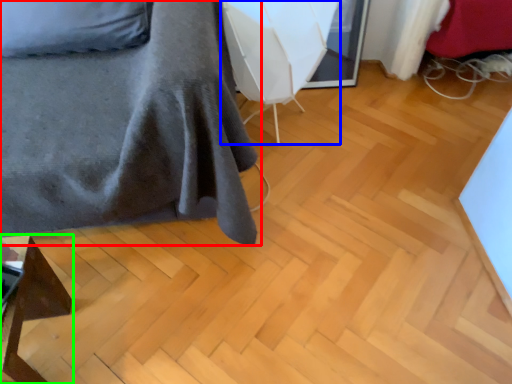
Question: Considering the real-world distances, which object is closest to furniture (highlighted by a red box)? swivel chair (highlighted by a blue box) or furniture (highlighted by a green box).

Choices:
 (A) swivel chair
 (B) furniture

Answer: (A)